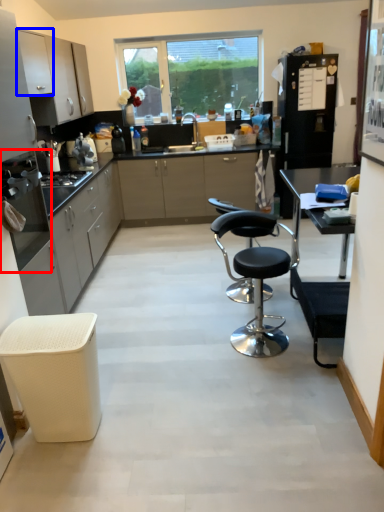
Question: Which point is further to the camera, kitchen appliance (highlighted by a red box) or cabinetry (highlighted by a blue box)?

Choices:
 (A) kitchen appliance
 (B) cabinetry

Answer: (B)